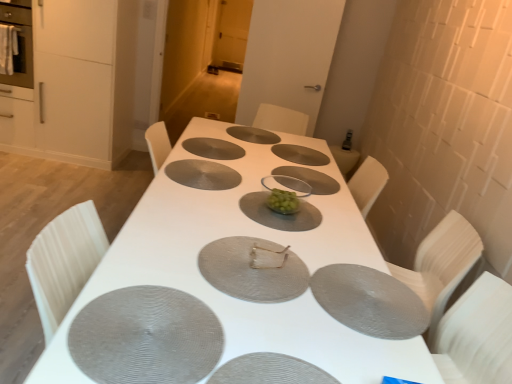
At what (x,y) coordinates should I click in order to perform the action: click on vacant area that lies between gray textured placemat at center, the 5th pizza pan in the front-to-back sequence, and metallic silver napkin at center. Please return your answer as a coordinate pair (x, y). Looking at the image, I should click on (221, 203).